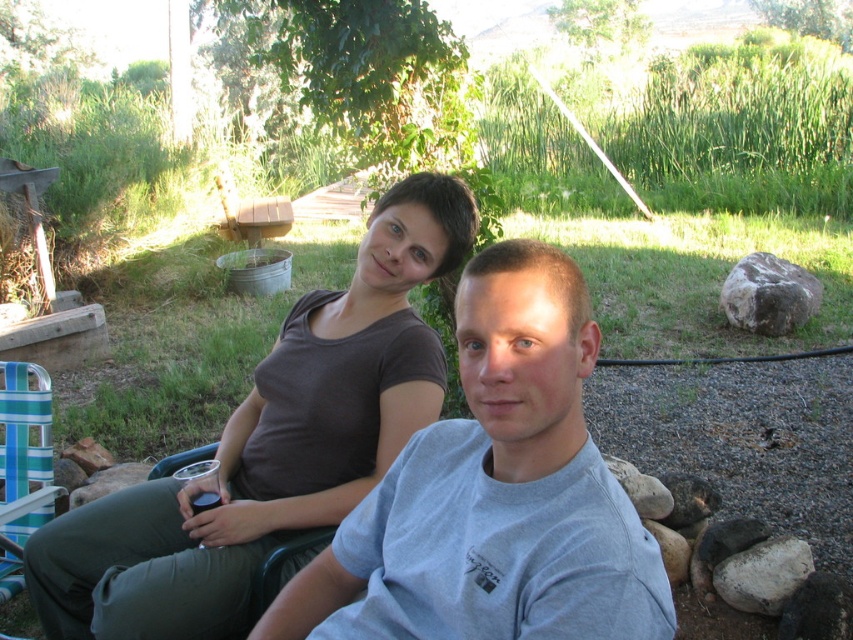
You are planning to place a 10 inch wide decorative plate between the matte brown shirt at upper center and the green plastic chair at lower left. Can the plate fit in the space between them?

The distance between the matte brown shirt at upper center and the green plastic chair at lower left is 12.78 inches. Since the plate is 10 inches wide, it can fit in the space between them as there is enough room.

You are standing in the backyard and see the point marked at coordinates (271, 444). Which object from the scene does this point lie on?

The point at coordinates (271, 444) lies on the matte brown shirt at upper center.

You are standing in the backyard and want to place a small potted plant between the two points labeled point (426,262) and point (277,552). Which point should the plant be closer to in order to be closer to the viewer?

The plant should be placed closer to point (426,262) because it is closer to the viewer than point (277,552).